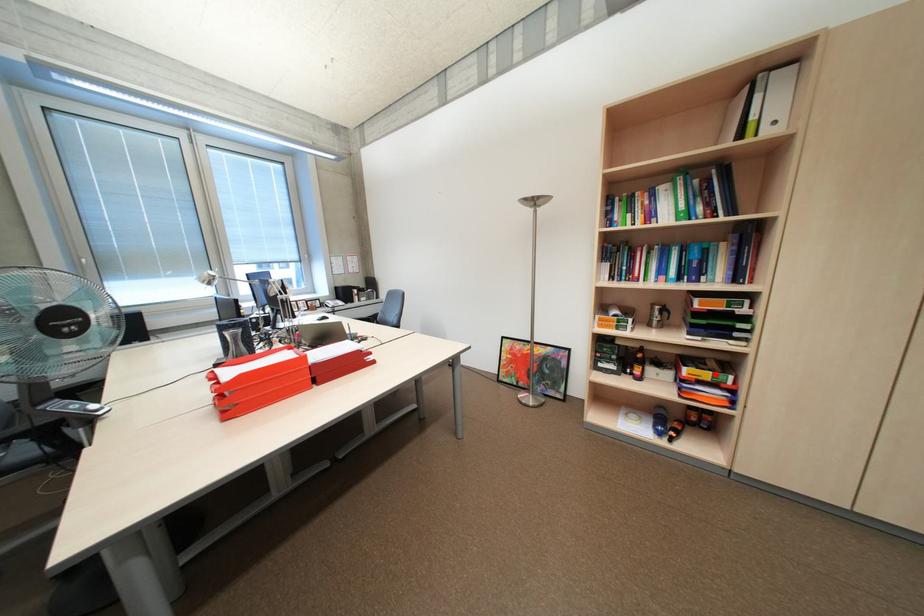
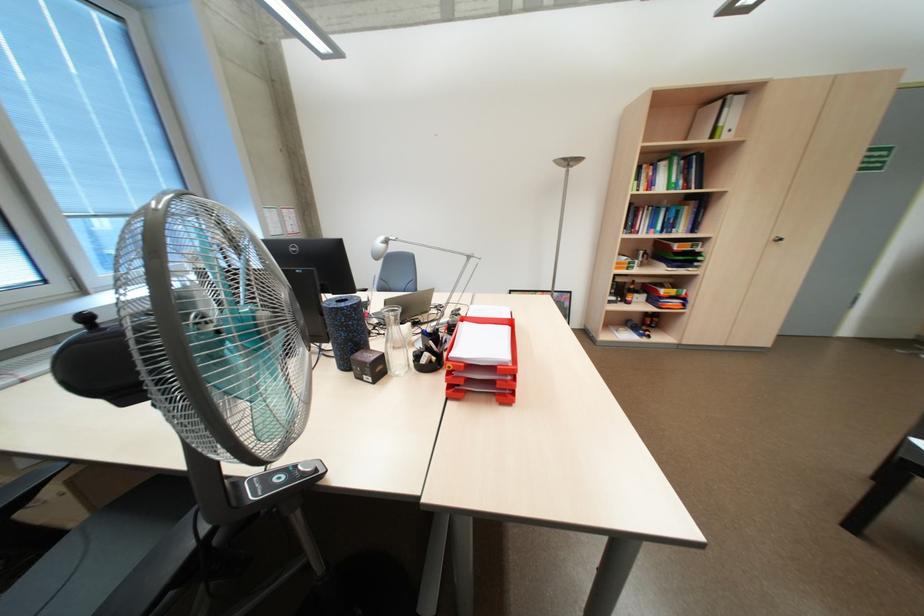
Question: I am providing you with two images of the same scene from different viewpoints. A red point is shown in image1. For the corresponding object point in image2, is it positioned nearer or farther from the camera?

Choices:
 (A) Nearer
 (B) Farther

Answer: (A)